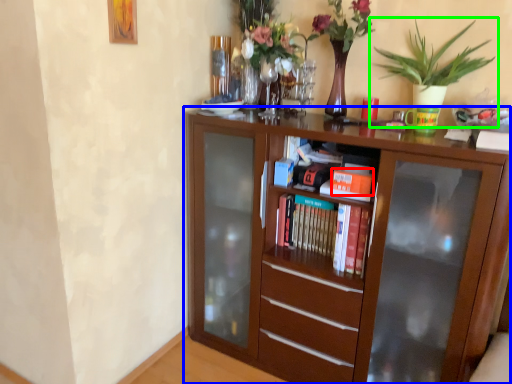
Question: Which object is the closest to the book (highlighted by a red box)? Choose among these: bookcase (highlighted by a blue box) or houseplant (highlighted by a green box).

Choices:
 (A) bookcase
 (B) houseplant

Answer: (A)